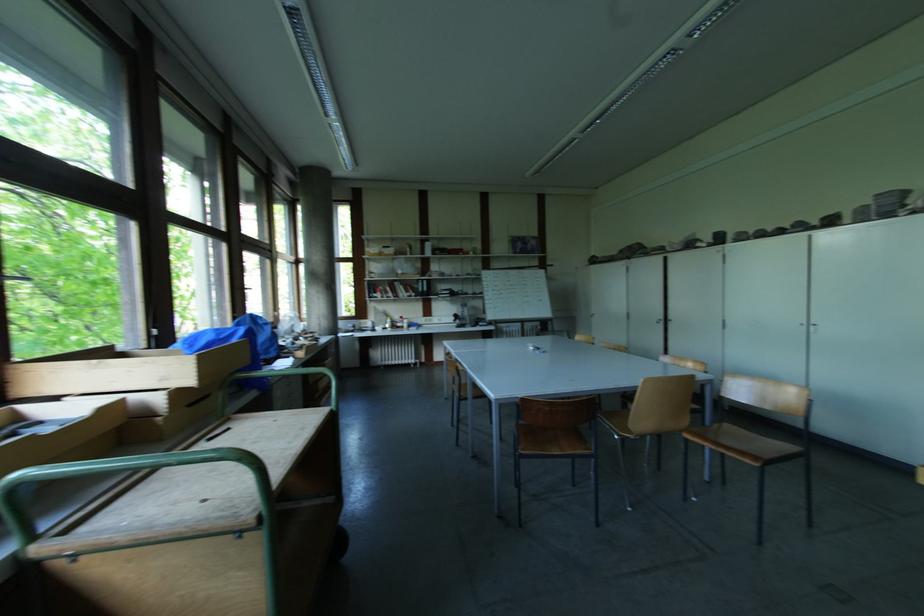
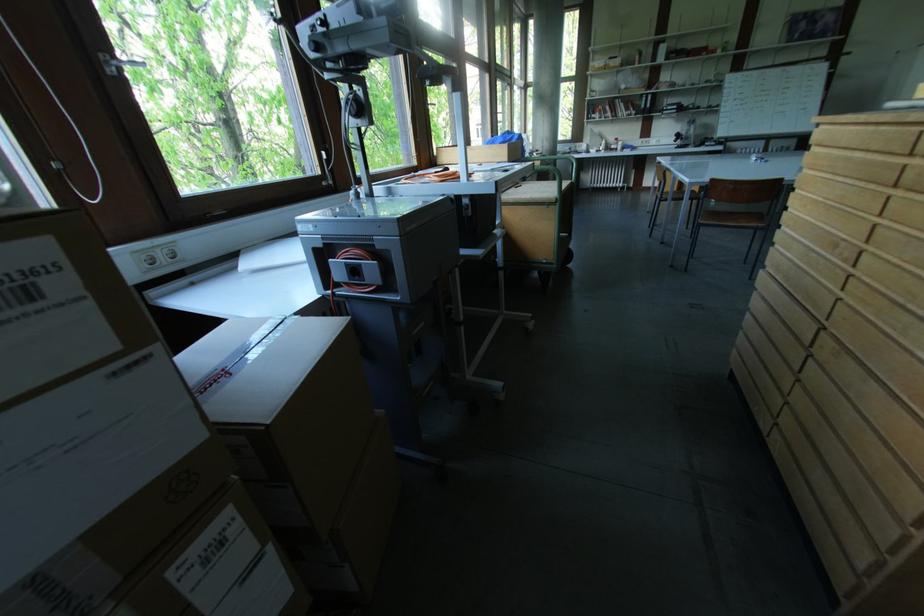
The point at (x=237, y=342) is marked in the first image. Where is the corresponding point in the second image?

(516, 144)